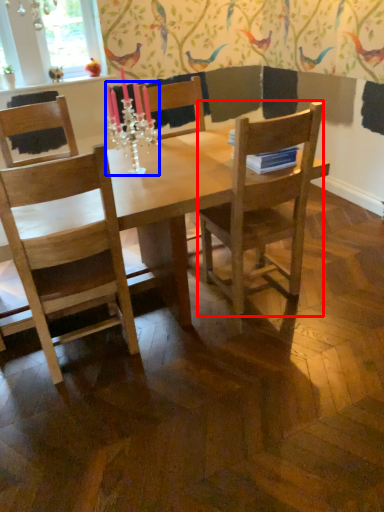
Question: Which object is further to the camera taking this photo, chair (highlighted by a red box) or candle holder (highlighted by a blue box)?

Choices:
 (A) chair
 (B) candle holder

Answer: (B)